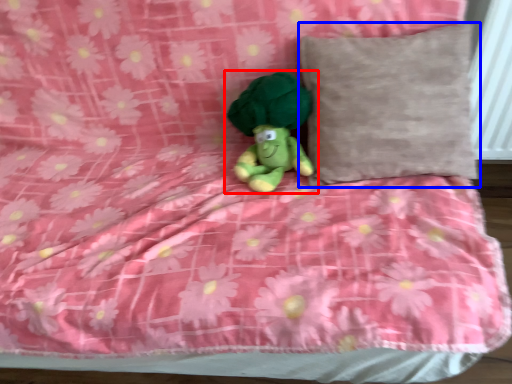
Question: Among these objects, which one is farthest to the camera, toy (highlighted by a red box) or pillow (highlighted by a blue box)?

Choices:
 (A) toy
 (B) pillow

Answer: (A)